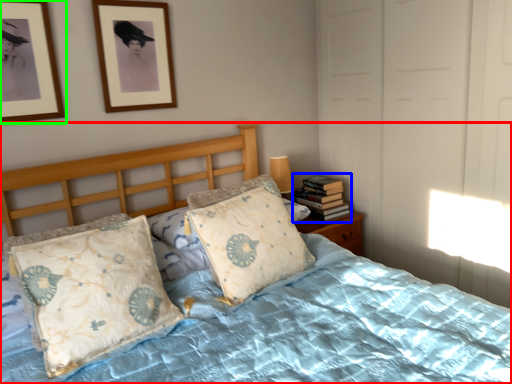
Question: Based on their relative distances, which object is farther from bed (highlighted by a red box)? Choose from book (highlighted by a blue box) and picture frame (highlighted by a green box).

Choices:
 (A) book
 (B) picture frame

Answer: (B)